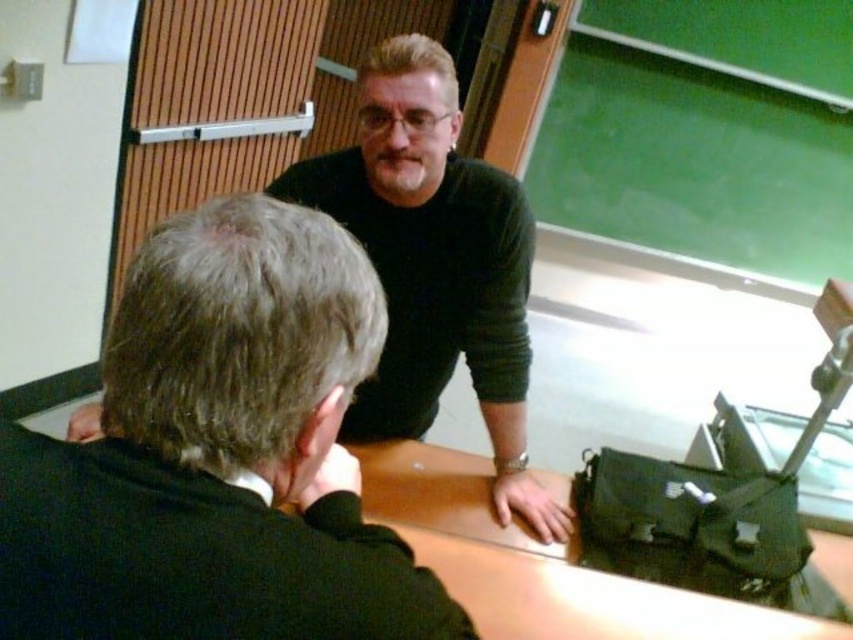
Can you confirm if dark green sweater at upper center is positioned above black matte sweater at upper center?

Incorrect, dark green sweater at upper center is not positioned above black matte sweater at upper center.

Who is taller, dark green sweater at upper center or black matte sweater at upper center?

Standing taller between the two is black matte sweater at upper center.

Locate an element on the screen. The image size is (853, 640). dark green sweater at upper center is located at coordinates (218, 452).